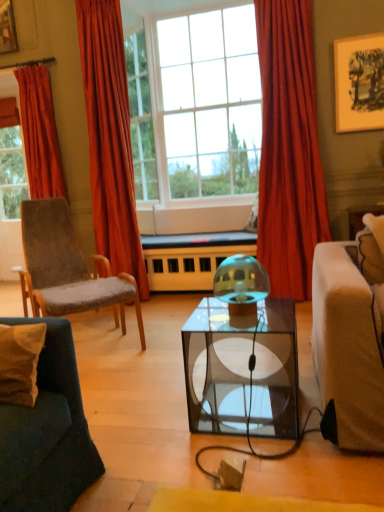
The width and height of the screenshot is (384, 512). What are the coordinates of `free location to the left of transparent glass coffee table at center` in the screenshot? It's located at pos(153,418).